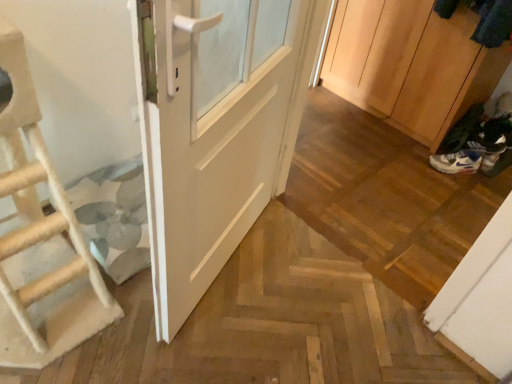
Locate an element on the screen. The height and width of the screenshot is (384, 512). vacant location below white matte door at center (from a real-world perspective) is located at coordinates (229, 264).